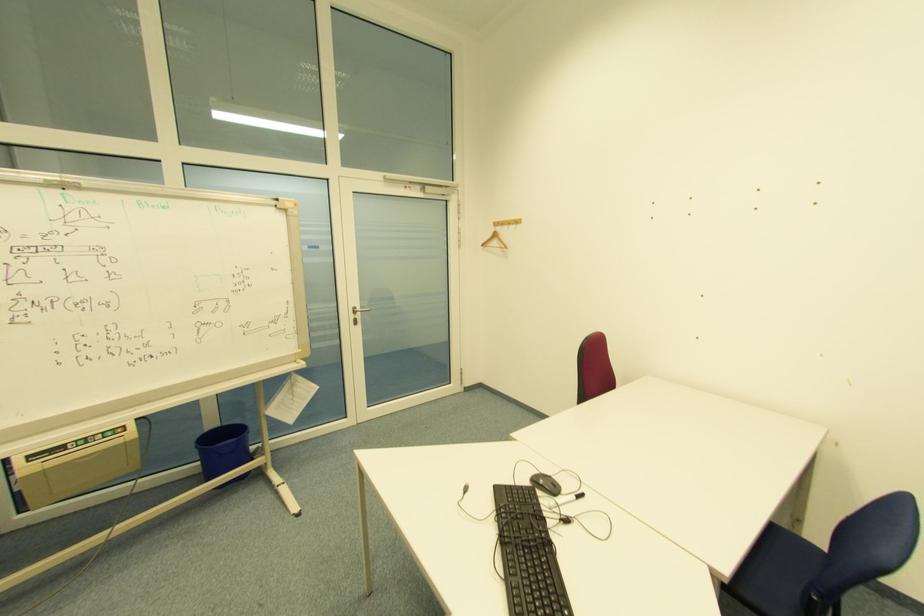
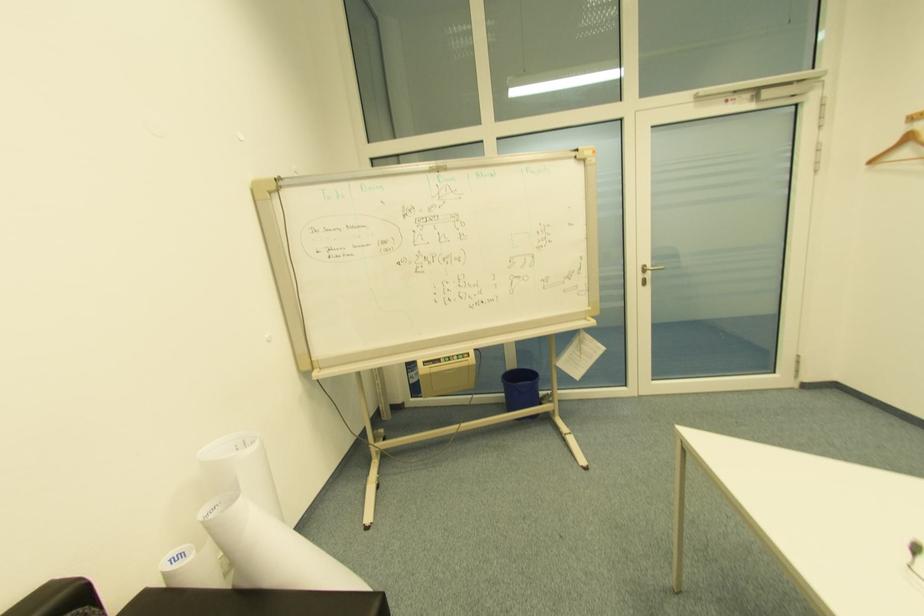
Question: The camera is either moving clockwise (left) or counter-clockwise (right) around the object. The first image is from the beginning of the video and the second image is from the end. Is the camera moving left or right when shooting the video?

Choices:
 (A) Left
 (B) Right

Answer: (B)